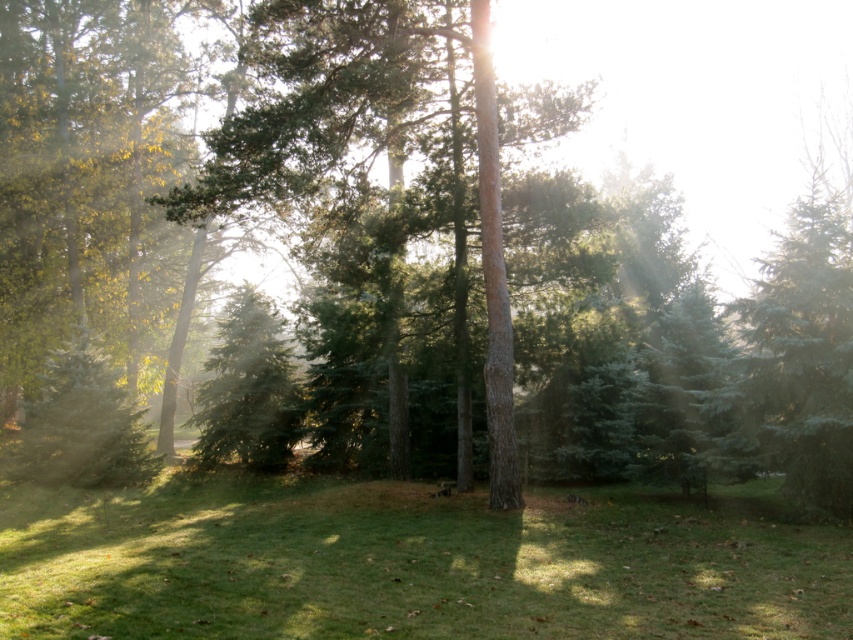
You are a hiker trying to find the best spot to set up your tent. You see green grass at center and green matte tree at center. Which area would be more suitable for setting up your tent?

→ The green grass at center occupies less space than the green matte tree at center, so the green grass at center would be more suitable for setting up the tent since it has more open space.

You are a hiker who wants to take a photo of the green grass at center and the green matte tree at center. Which object should you focus on first if you want both to be in sharp focus?

To ensure both the green grass at center and the green matte tree at center are in sharp focus, you should focus on the green matte tree at center first since it is farther away from the camera than the green grass at center.

Looking at this image, you are a hiker who wants to take a photo of the green grass at center and the green matte tree at center. Which object should you focus on first to ensure both are in the frame?

The green grass at center is in front of the green matte tree at center, so you should focus on the green grass at center first to ensure both are in the frame.